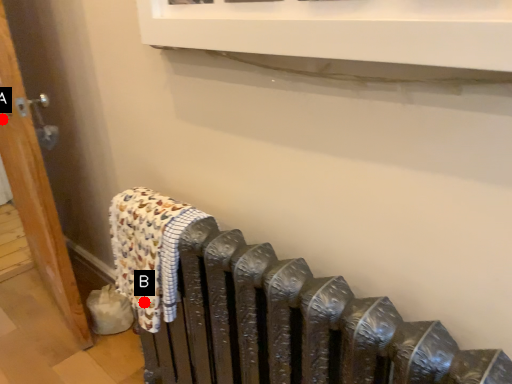
Question: Two points are circled on the image, labeled by A and B beside each circle. Which of the following is the farthest from the observer?

Choices:
 (A) A is further
 (B) B is further

Answer: (A)